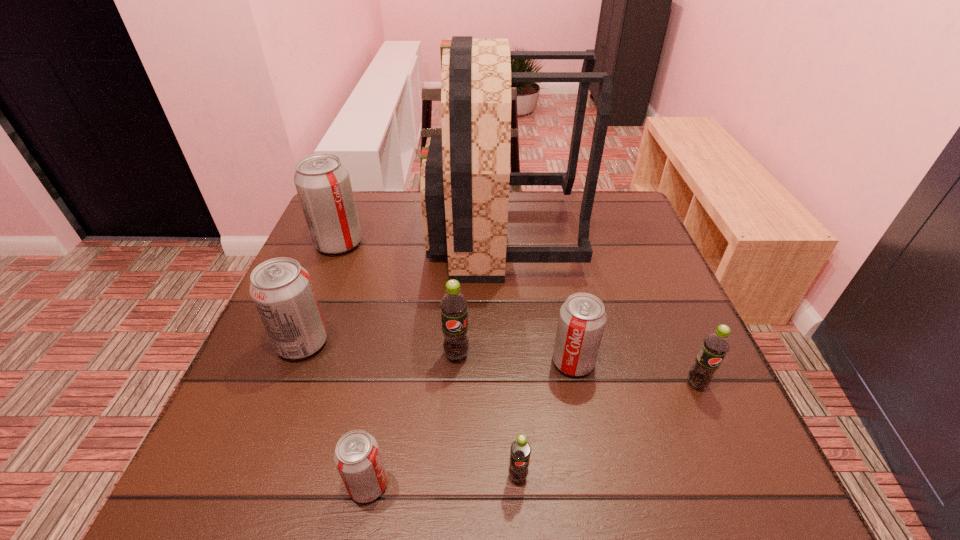
This screenshot has height=540, width=960. I want to click on the smallest green soda, so click(520, 450).

Where is `the second green soda from right to left`? the second green soda from right to left is located at coordinates (520, 450).

The height and width of the screenshot is (540, 960). Identify the location of the smallest gray soda can. (357, 457).

Locate an element on the screen. The width and height of the screenshot is (960, 540). the third gray soda can from left to right is located at coordinates (357, 457).

The height and width of the screenshot is (540, 960). Identify the location of vacant region located 0.090m on the front face of the backpack. (396, 235).

Find the location of a particular element. vacant space situated on the front face of the backpack is located at coordinates (385, 235).

Where is `free space located on the front face of the backpack`? This screenshot has height=540, width=960. free space located on the front face of the backpack is located at coordinates (385, 235).

Locate an element on the screen. free region located on the right of the biggest gray soda can is located at coordinates (445, 244).

Locate an element on the screen. This screenshot has height=540, width=960. free space located on the front label of the biggest green soda is located at coordinates (450, 482).

Where is `free space located 0.100m on the right of the second biggest gray soda can`? free space located 0.100m on the right of the second biggest gray soda can is located at coordinates (376, 343).